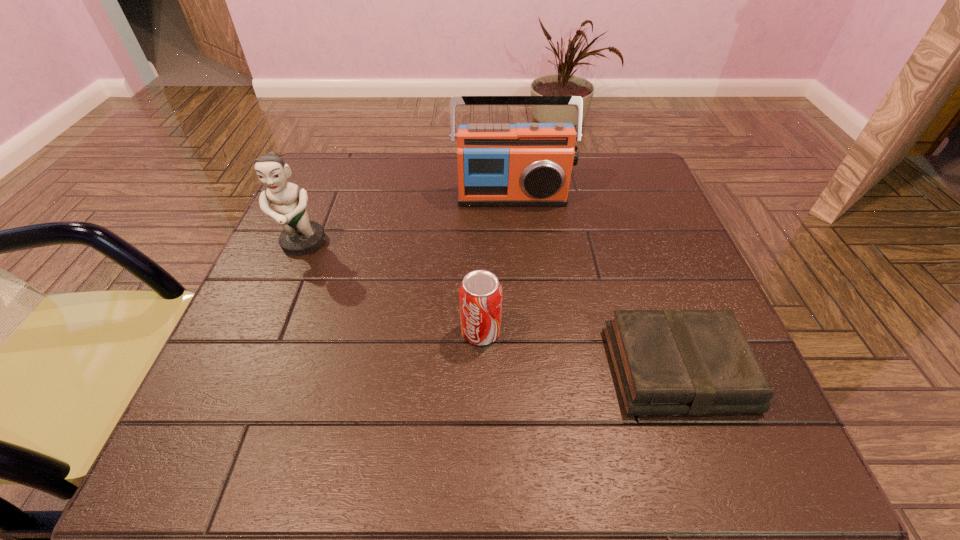
The image size is (960, 540). What are the coordinates of `the farthest object` in the screenshot? It's located at (525, 164).

Locate an element on the screen. the leftmost object is located at coordinates 300,236.

I want to click on the second farthest object, so click(300, 236).

This screenshot has height=540, width=960. What are the coordinates of `the second shortest object` in the screenshot? It's located at (480, 294).

Where is `book`? book is located at coordinates (666, 362).

Locate an element on the screen. vacant area situated on the front-facing side of the farthest object is located at coordinates (518, 272).

Locate an element on the screen. The height and width of the screenshot is (540, 960). free space located 0.260m on the front-facing side of the leftmost object is located at coordinates (251, 368).

You are a GUI agent. You are given a task and a screenshot of the screen. Output one action in this format:
    pyautogui.click(x=<x>, y=<y>)
    Task: Click on the blank space located on the left of the second shortest object
    The width and height of the screenshot is (960, 540).
    Given the screenshot: What is the action you would take?
    pyautogui.click(x=389, y=332)

Locate an element on the screen. The width and height of the screenshot is (960, 540). vacant area located on the left of the book is located at coordinates pos(493,369).

At what (x,y) coordinates should I click in order to perform the action: click on object situated at the far edge. Please return your answer as a coordinate pair (x, y). The height and width of the screenshot is (540, 960). Looking at the image, I should click on (525, 164).